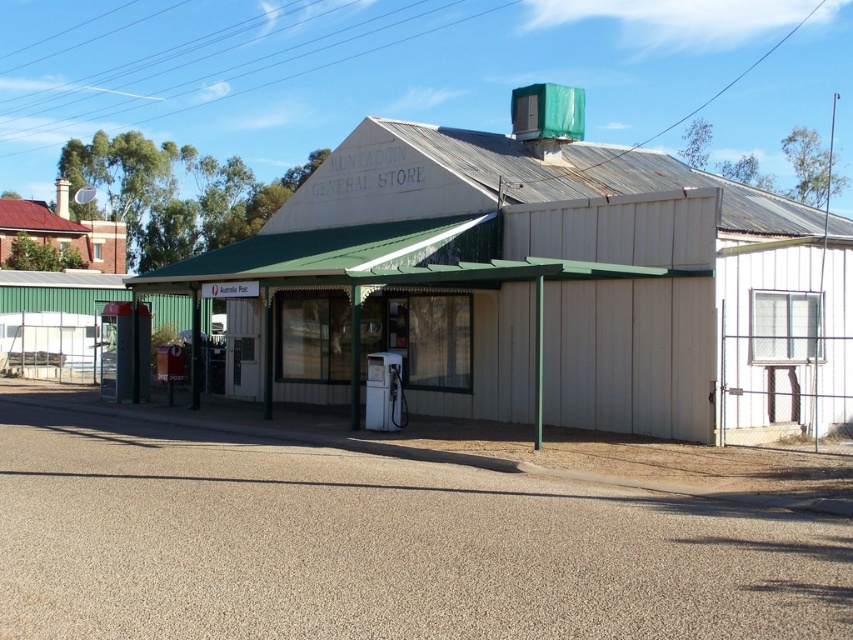
Question: Does white wood building at center appear on the left side of red tiled roof at upper left?

Choices:
 (A) no
 (B) yes

Answer: (A)

Question: Which point is farther from the camera taking this photo?

Choices:
 (A) (477, 305)
 (B) (97, 236)

Answer: (B)

Question: Which point appears farthest from the camera in this image?

Choices:
 (A) (764, 371)
 (B) (105, 259)

Answer: (B)

Question: Is white wood building at center below red tiled roof at upper left?

Choices:
 (A) no
 (B) yes

Answer: (B)

Question: Is white wood building at center positioned before red tiled roof at upper left?

Choices:
 (A) no
 (B) yes

Answer: (B)